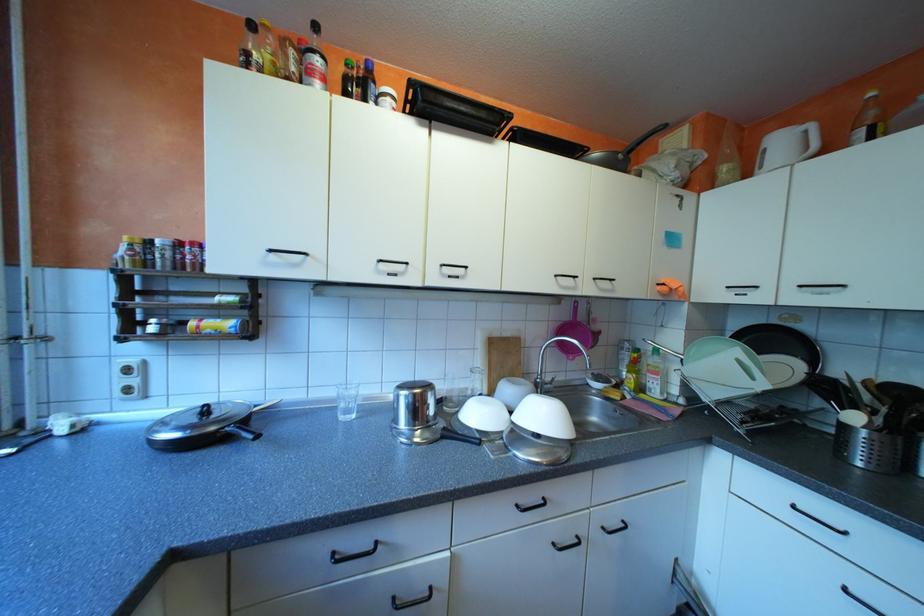
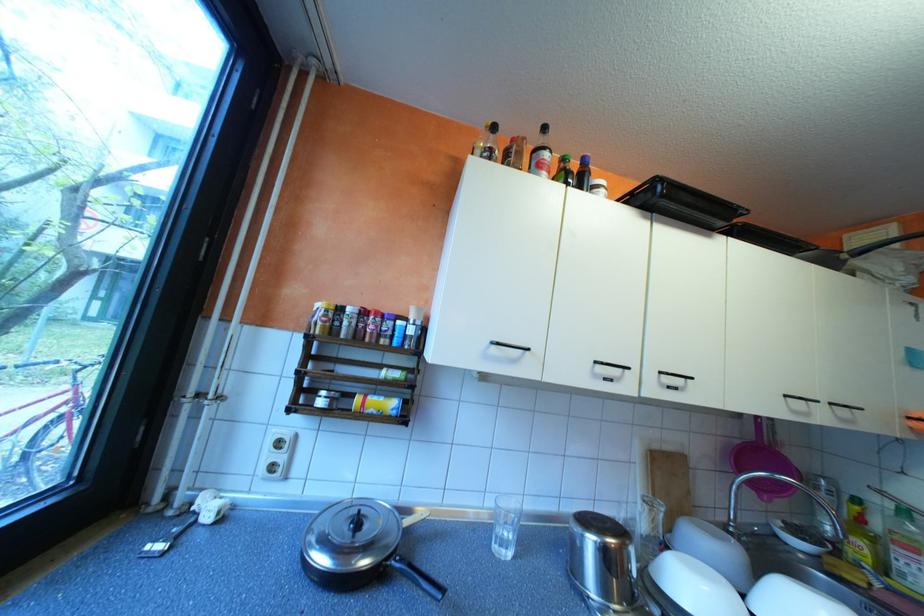
The point at (455,274) is marked in the first image. Where is the corresponding point in the second image?

(673, 383)